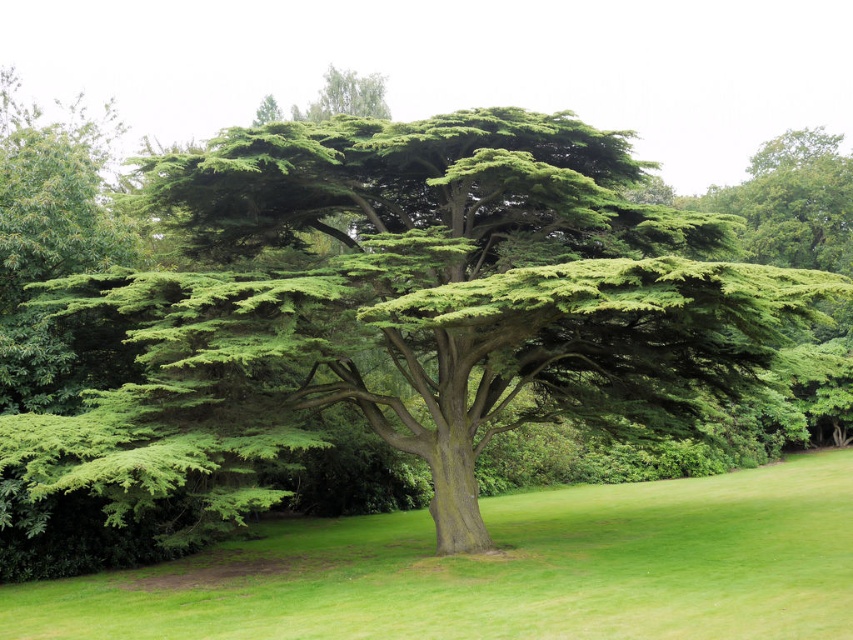
You are standing in the park looking at the large tree. There are two points marked on the tree trunk. One is at coordinate point (57, 451) and the other is at coordinate point (109, 573). Which point is closer to you?

Point (57, 451) is closer to the viewer than point (109, 573).

You are standing at the edge of the park and see the green textured tree at center and the green grass at center. Which object is positioned to the left?

The green textured tree at center is to the left of the green grass at center.